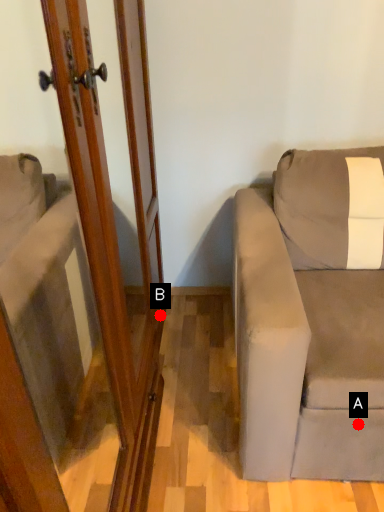
Question: Two points are circled on the image, labeled by A and B beside each circle. Which point is closer to the camera?

Choices:
 (A) A is closer
 (B) B is closer

Answer: (A)